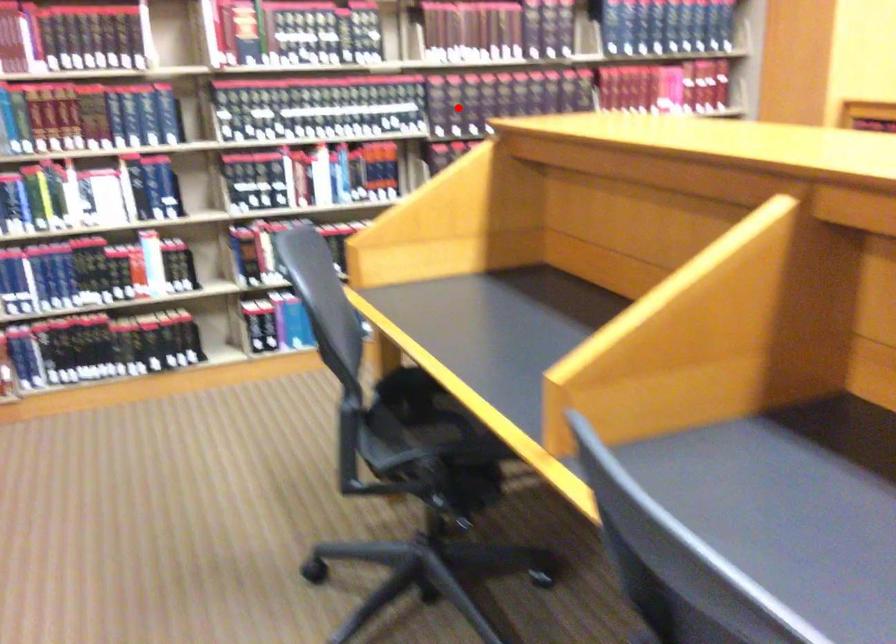
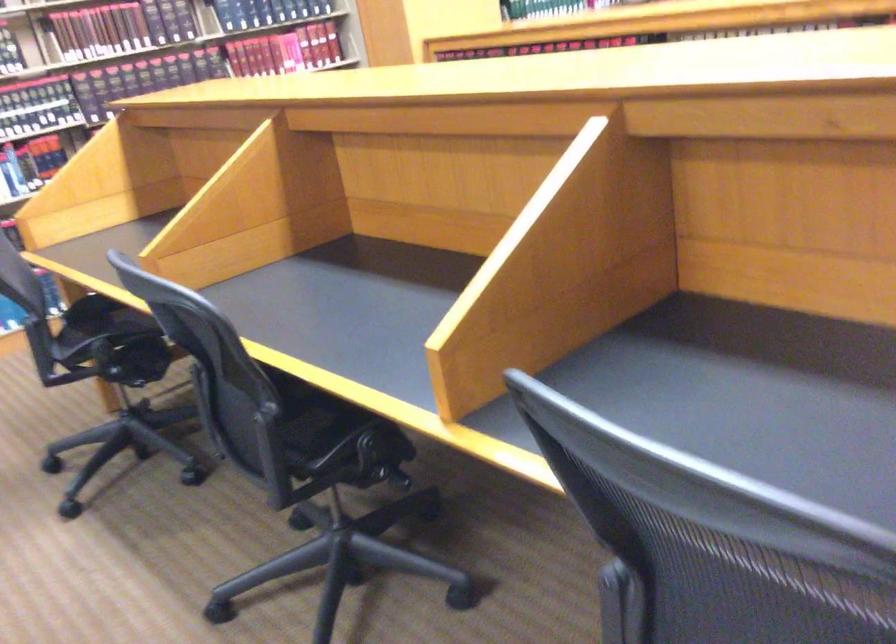
Question: I am providing you with two images of the same scene from different viewpoints. A red point is shown in image1. For the corresponding object point in image2, is it positioned nearer or farther from the camera?

Choices:
 (A) Nearer
 (B) Farther

Answer: (B)